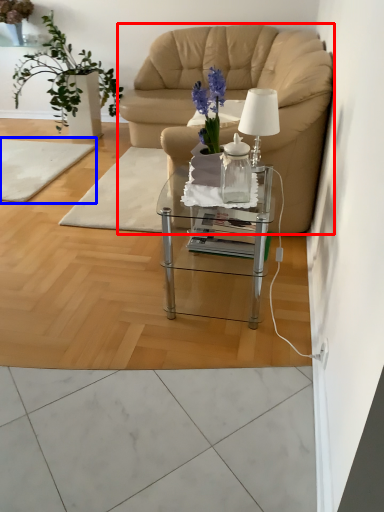
Question: Among these objects, which one is farthest to the camera, chair (highlighted by a red box) or mat (highlighted by a blue box)?

Choices:
 (A) chair
 (B) mat

Answer: (B)